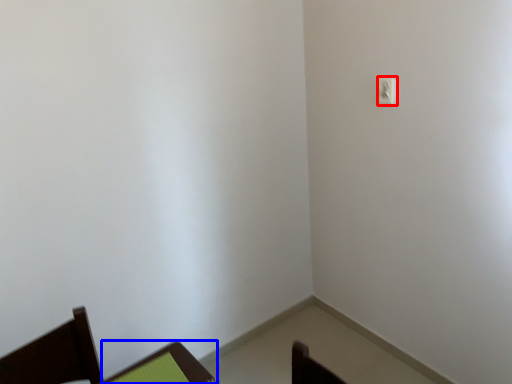
Question: Which object appears farthest to the camera in this image, light switch (highlighted by a red box) or furniture (highlighted by a blue box)?

Choices:
 (A) light switch
 (B) furniture

Answer: (A)